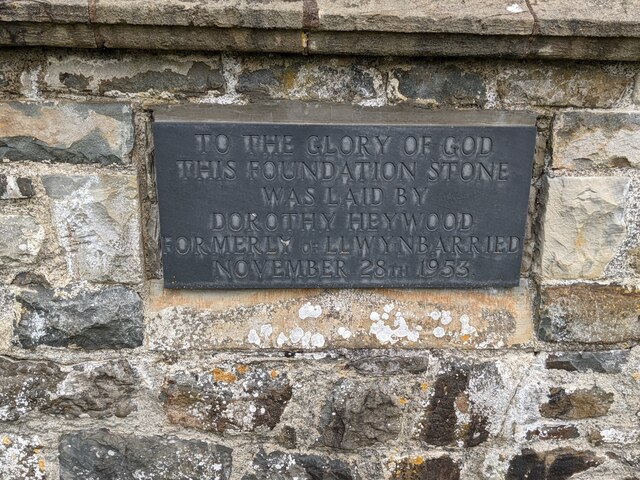
Image resolution: width=640 pixels, height=480 pixels. I want to click on marble plaque, so click(x=166, y=137).